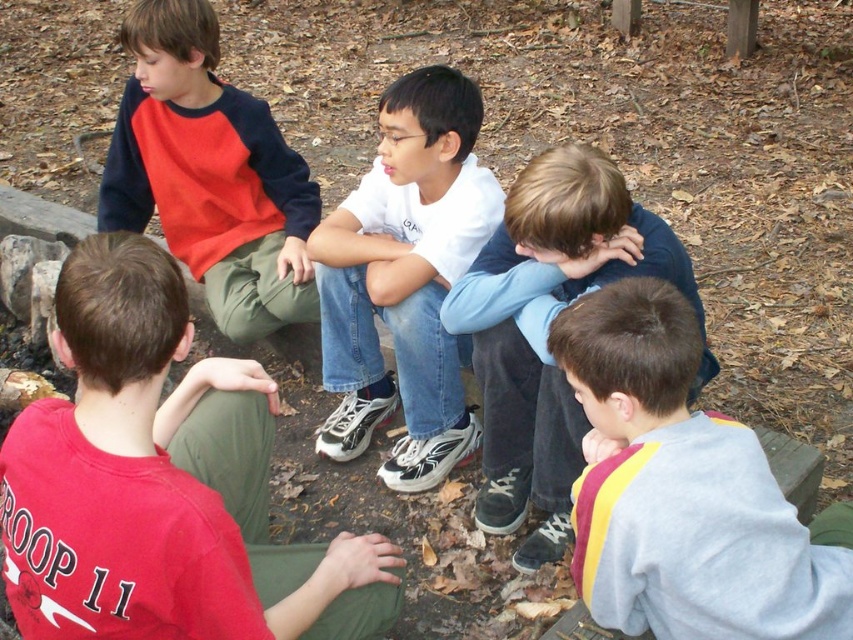
Question: Which point is farther from the camera taking this photo?

Choices:
 (A) (206, 24)
 (B) (521, 276)

Answer: (A)

Question: Is white matte shirt at center below matte red and navy sweatshirt at left?

Choices:
 (A) yes
 (B) no

Answer: (A)

Question: Which is farther from the white matte shirt at center?

Choices:
 (A) light blue denim jeans at center
 (B) matte red shirt at lower left

Answer: (B)

Question: Considering the relative positions of white matte shirt at center and light blue denim jeans at center in the image provided, where is white matte shirt at center located with respect to light blue denim jeans at center?

Choices:
 (A) right
 (B) left

Answer: (B)

Question: Is matte red shirt at lower left further to camera compared to light blue denim jeans at center?

Choices:
 (A) yes
 (B) no

Answer: (B)

Question: Which object appears farthest from the camera in this image?

Choices:
 (A) matte red shirt at lower left
 (B) light blue denim jeans at center

Answer: (B)